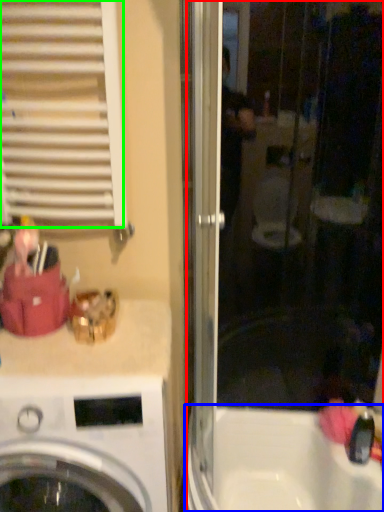
Question: Which object is positioned closest to screen door (highlighted by a red box)? Select from bath (highlighted by a blue box) and shutter (highlighted by a green box).

Choices:
 (A) bath
 (B) shutter

Answer: (A)